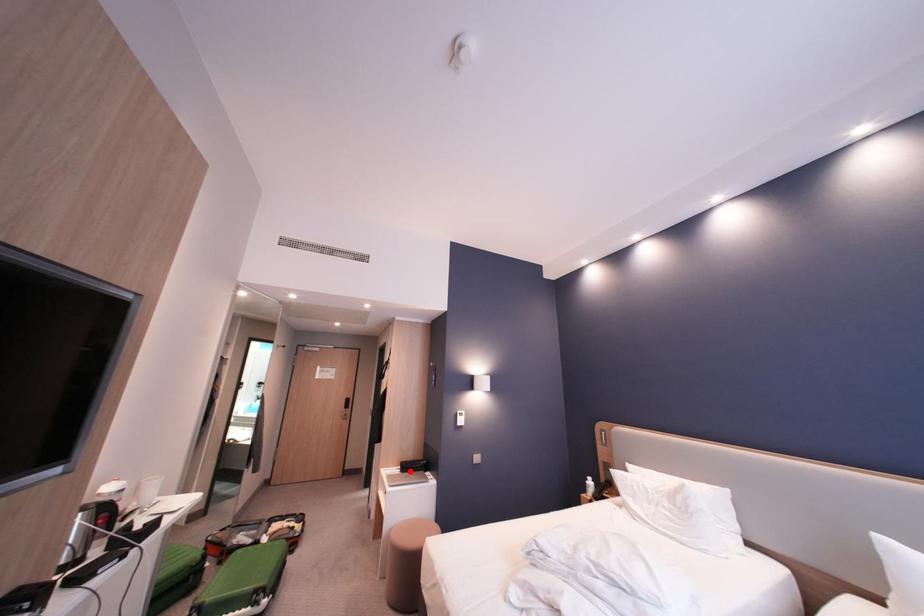
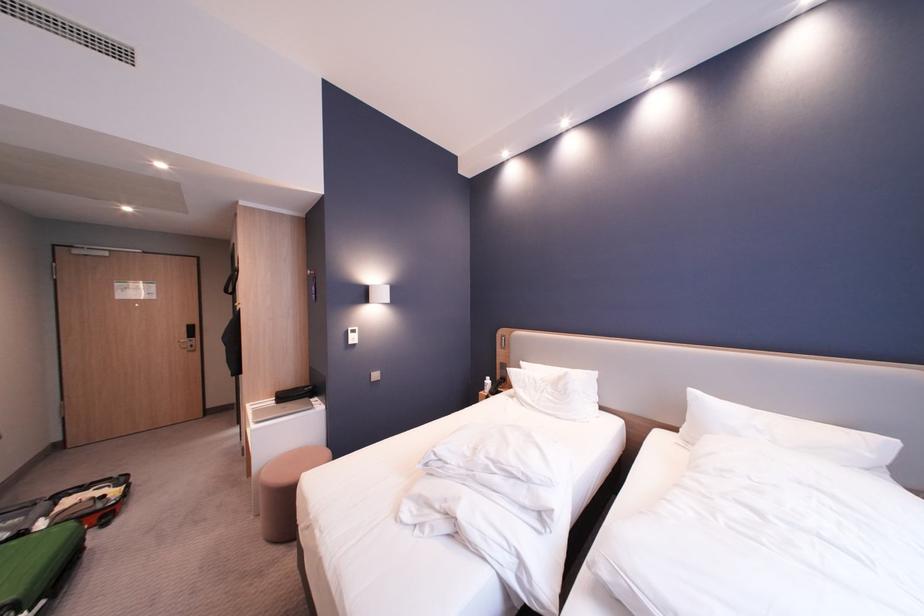
The point at the highlighted location is marked in the first image. Where is the corresponding point in the second image?

(285, 403)